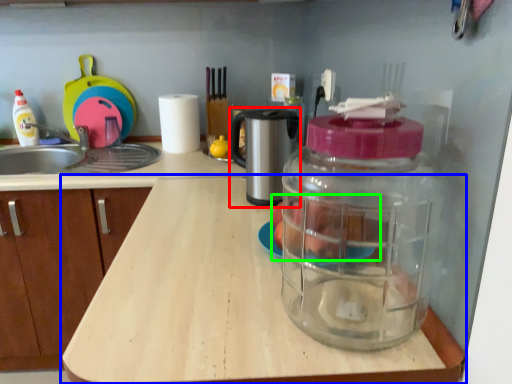
Question: Based on their relative distances, which object is nearer to coffee machine (highlighted by a red box)? Choose from countertop (highlighted by a blue box) and food (highlighted by a green box).

Choices:
 (A) countertop
 (B) food

Answer: (B)